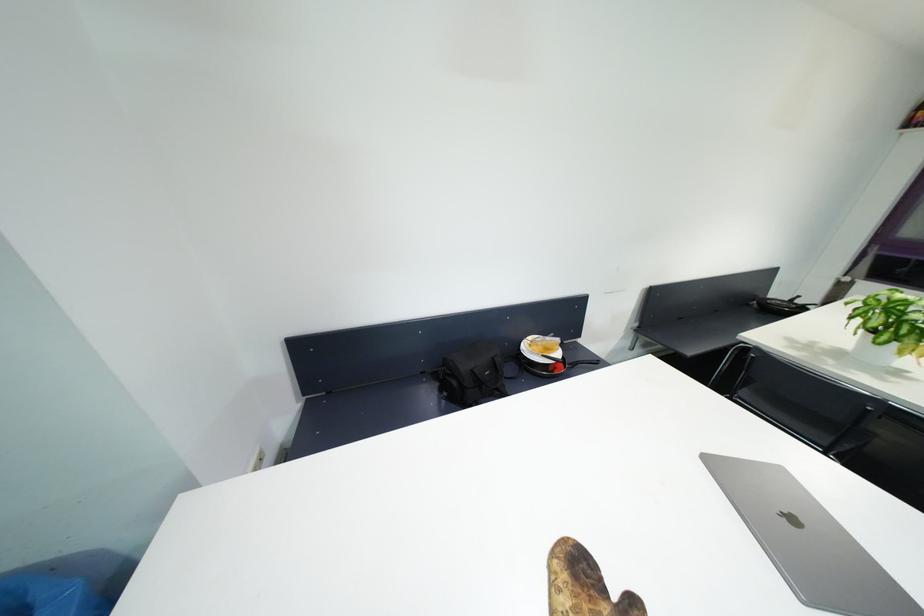
What do you see at coordinates (586, 362) in the screenshot?
I see `the black pan handle` at bounding box center [586, 362].